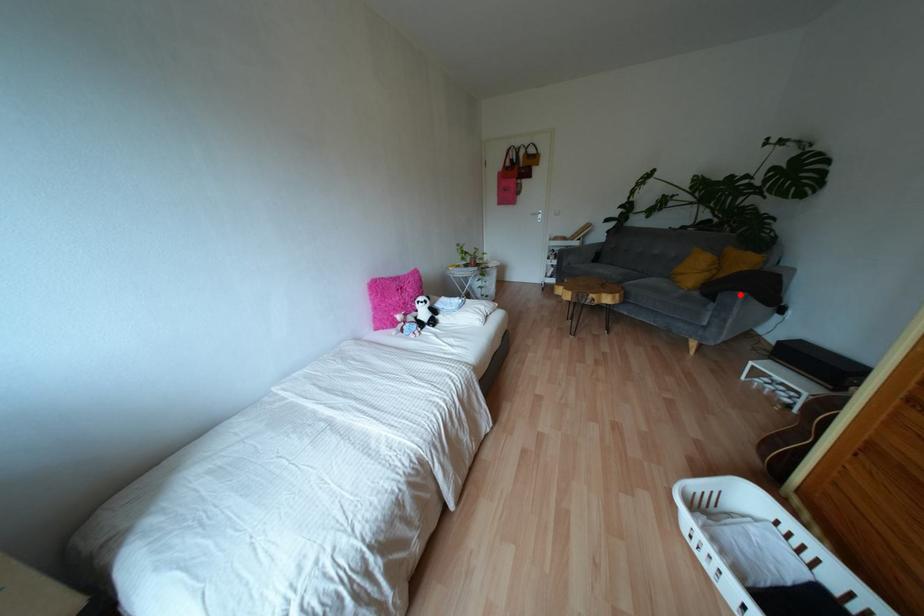
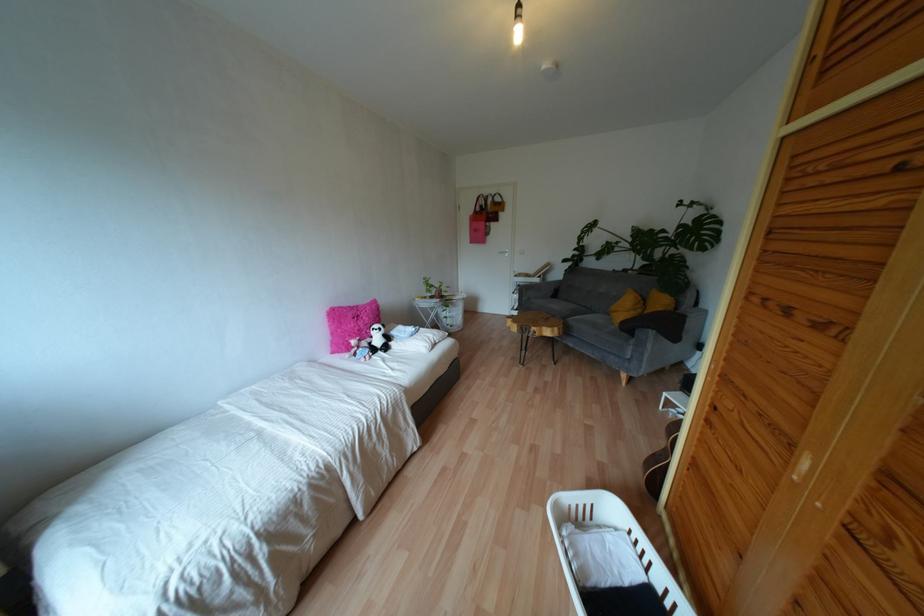
In the second image, find the point that corresponds to the highlighted location in the first image.

(650, 331)